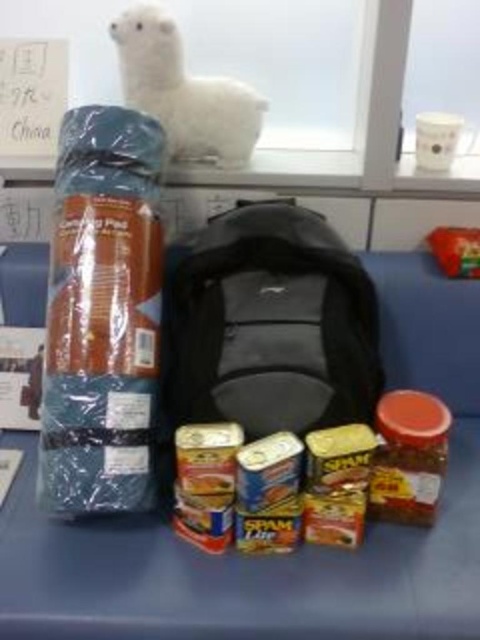
Can you confirm if black fabric backpack at center is positioned to the right of white plush at upper center?

Correct, you'll find black fabric backpack at center to the right of white plush at upper center.

Can you confirm if black fabric backpack at center is shorter than white plush at upper center?

Incorrect, black fabric backpack at center's height does not fall short of white plush at upper center's.

Locate an element on the screen. black fabric backpack at center is located at coordinates (268, 324).

Where is `black fabric backpack at center`? The image size is (480, 640). black fabric backpack at center is located at coordinates (268, 324).